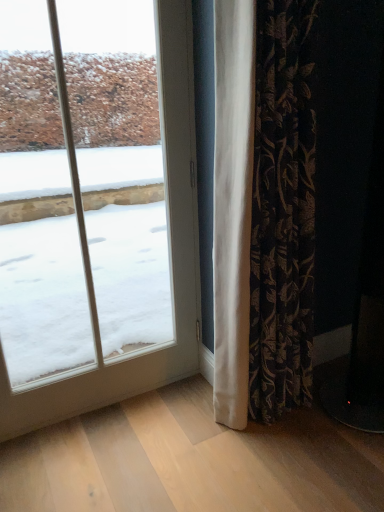
Question: Should I look upward or downward to see transparent glass window at left?

Choices:
 (A) down
 (B) up

Answer: (B)